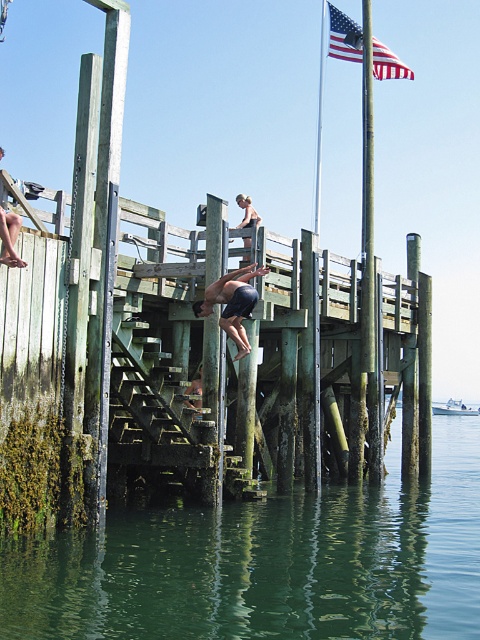
Question: Can you confirm if green weathered wood dock at center is positioned to the right of matte black shorts at center?

Choices:
 (A) no
 (B) yes

Answer: (A)

Question: Which point is closer to the camera?

Choices:
 (A) green mossy water at lower center
 (B) american flag at upper center
 (C) smooth skin human at center
 (D) matte black shorts at center

Answer: (A)

Question: Which object is the farthest from the green wood pole at center?

Choices:
 (A) green mossy water at lower center
 (B) smooth skin person at center

Answer: (B)

Question: Is american flag at upper center above smooth skin human at center?

Choices:
 (A) no
 (B) yes

Answer: (B)

Question: Which point is farther from the camera taking this photo?

Choices:
 (A) (193, 390)
 (B) (332, 26)
 (C) (122, 388)

Answer: (B)

Question: Can you confirm if green weathered wood dock at center is bigger than smooth skin person at center?

Choices:
 (A) yes
 (B) no

Answer: (A)